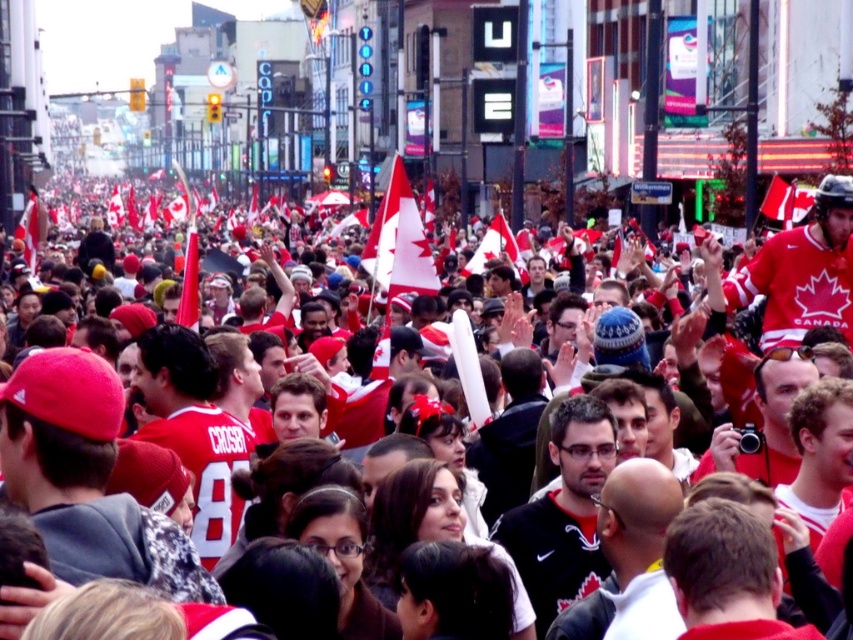
You are a photographer standing on the street and want to capture both the red fabric crowd at center and the red fabric flag at upper right in a single photo. Which object should you focus on first to ensure both are in frame?

You should focus on the red fabric crowd at center first because it is taller than the red fabric flag at upper right, so adjusting the camera angle to include its height will naturally include the shorter flag in the frame.

You are standing at the point labeled as point (582, 529) in the image. What do you see directly in front of you?

You see a red fabric crowd at center directly in front of you at point (582, 529).

Consider the image. You are a photographer standing at the origin point in the middle of the street. You want to capture a photo of the red fabric crowd at center. What are the coordinates where you should aim your camera?

The coordinates where you should aim your camera are at point (x=582, y=529) to capture the red fabric crowd at center.